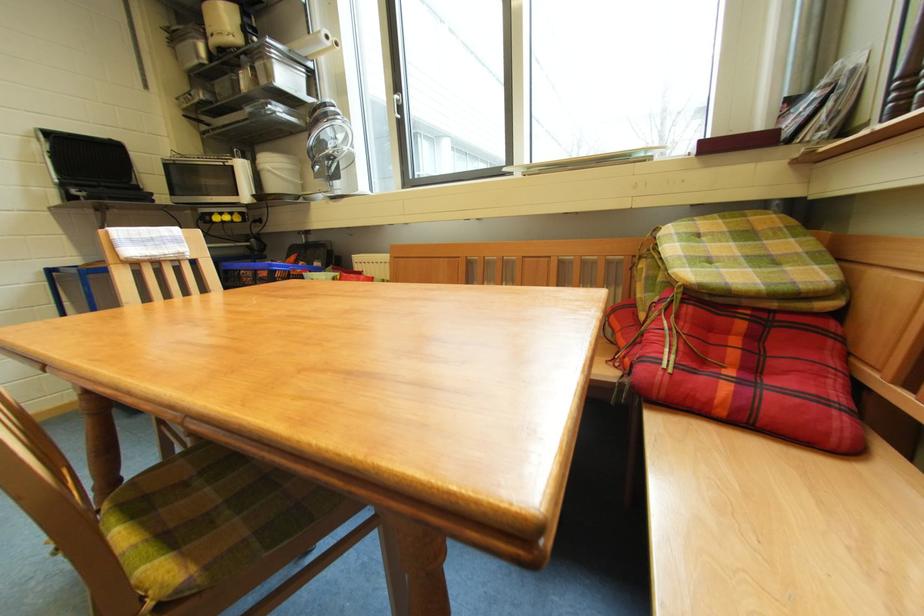
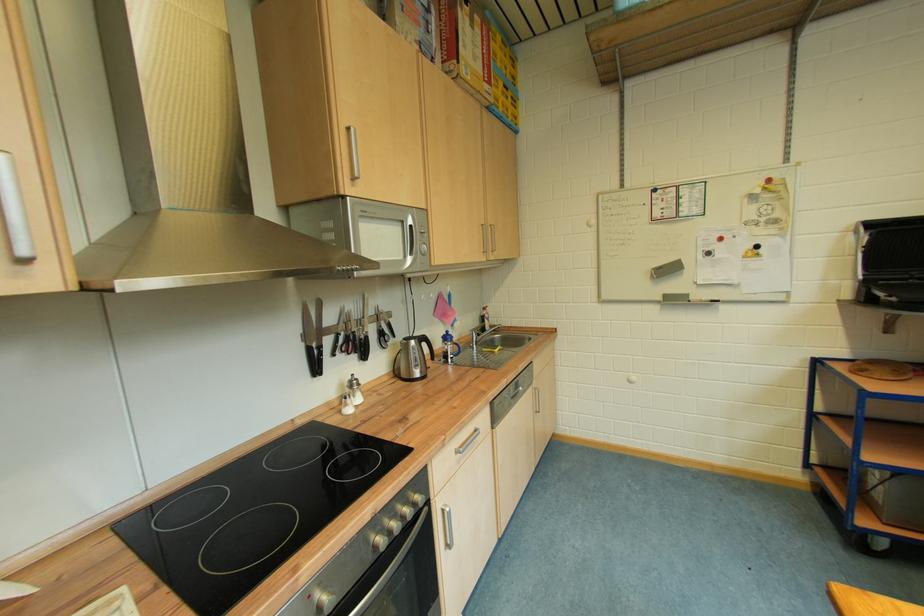
Question: The first image is from the beginning of the video and the second image is from the end. How did the camera likely rotate when shooting the video?

Choices:
 (A) Left
 (B) Right
 (C) Up
 (D) Down

Answer: (A)